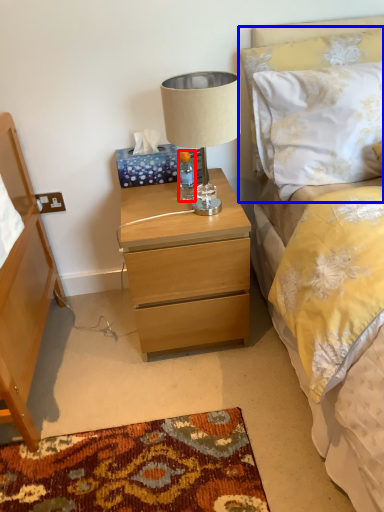
Question: Which object appears closest to the camera in this image, bottle (highlighted by a red box) or pillow (highlighted by a blue box)?

Choices:
 (A) bottle
 (B) pillow

Answer: (B)